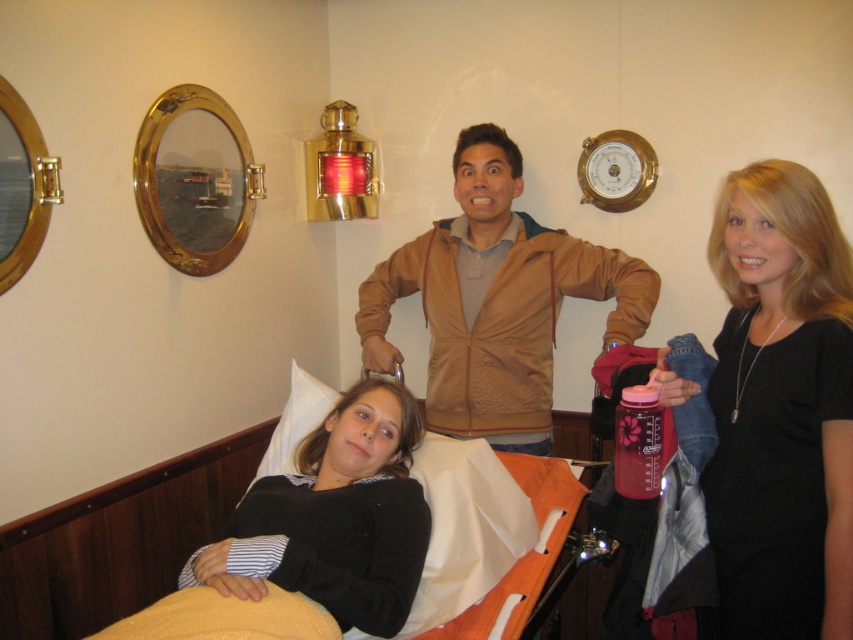
Is pink plastic water bottle at center above white soft pillow at lower center?

Indeed, pink plastic water bottle at center is positioned over white soft pillow at lower center.

Between point (630, 388) and point (292, 372), which one is positioned behind?

Point (292, 372)

At what (x,y) coordinates should I click in order to perform the action: click on pink plastic water bottle at center. Please return your answer as a coordinate pair (x, y). The height and width of the screenshot is (640, 853). Looking at the image, I should click on (637, 442).

Between brown textured jacket at center and white soft pillow at lower center, which one appears on the left side from the viewer's perspective?

Positioned to the left is white soft pillow at lower center.

Is brown textured jacket at center closer to the viewer compared to white soft pillow at lower center?

No, brown textured jacket at center is further to the viewer.

This screenshot has width=853, height=640. In order to click on brown textured jacket at center in this screenshot , I will do `click(496, 301)`.

Can you confirm if black matte dress at center is positioned to the right of white soft pillow at lower center?

Indeed, black matte dress at center is positioned on the right side of white soft pillow at lower center.

Which is more to the right, black matte dress at center or white soft pillow at lower center?

From the viewer's perspective, black matte dress at center appears more on the right side.

What are the coordinates of `black matte dress at center` in the screenshot? It's located at pyautogui.click(x=781, y=408).